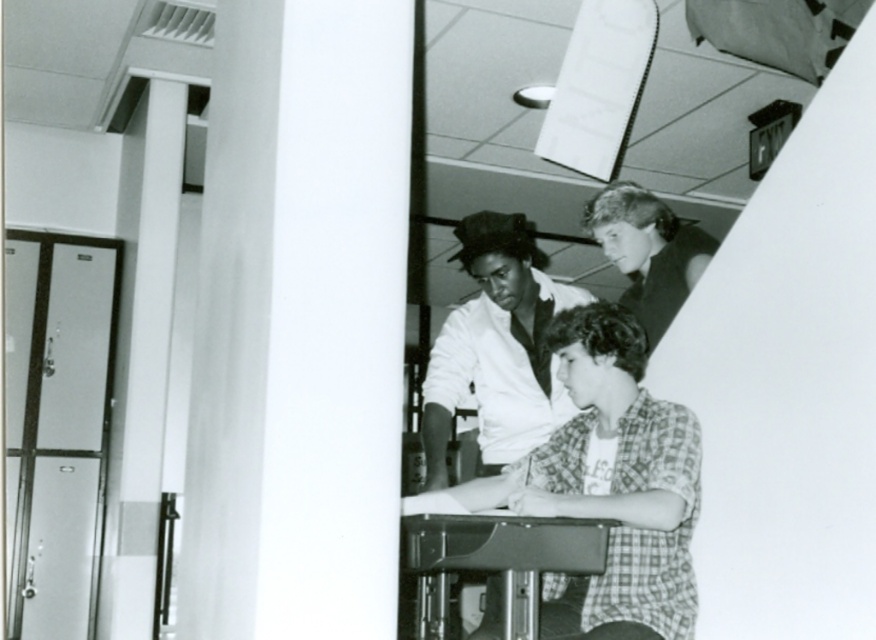
Question: Is smooth white shirt at center wider than metallic gray table at center?

Choices:
 (A) no
 (B) yes

Answer: (B)

Question: Which of the following is the closest to the observer?

Choices:
 (A) (684, 227)
 (B) (465, 518)

Answer: (B)

Question: Is metallic gray table at center below smooth light brown hair at upper right?

Choices:
 (A) yes
 (B) no

Answer: (A)

Question: Is metallic gray table at center thinner than smooth light brown hair at upper right?

Choices:
 (A) yes
 (B) no

Answer: (B)

Question: Which object is the farthest from the metallic gray table at center?

Choices:
 (A) smooth white shirt at center
 (B) smooth light brown hair at upper right

Answer: (B)

Question: Among these points, which one is farthest from the camera?

Choices:
 (A) (412, 532)
 (B) (622, 250)

Answer: (B)